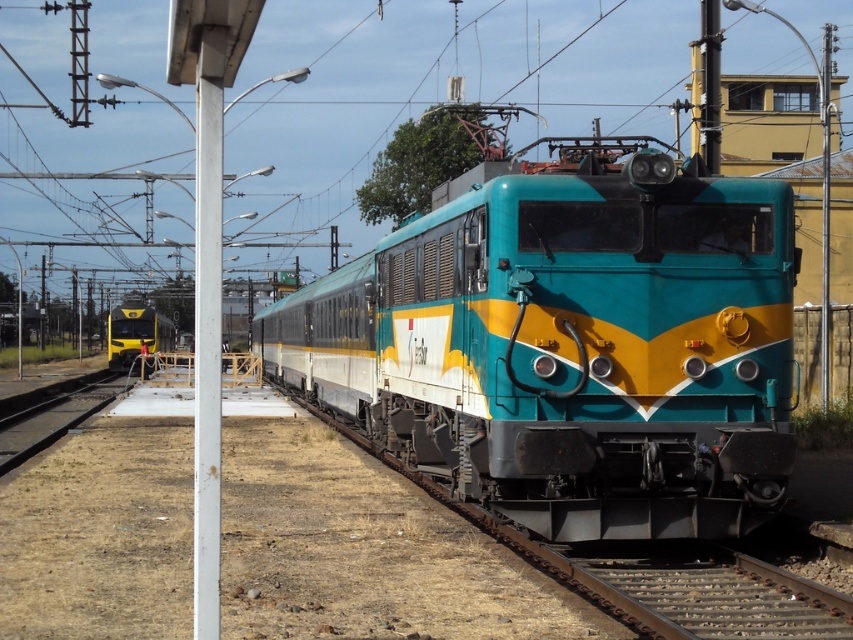
You are a maintenance worker standing on the platform. You need to inspect both the teal glossy train at center and the yellow glossy train at left. Which train is farther away from you?

The teal glossy train at center is farther away from you at 21.37 meters compared to the yellow glossy train at left.

You are a passenger waiting at the station platform. You see the teal glossy train at center and the yellow glossy train at left. Which train is nearer to you?

The teal glossy train at center is closer to the viewer than the yellow glossy train at left, so the teal glossy train at center is nearer to you.